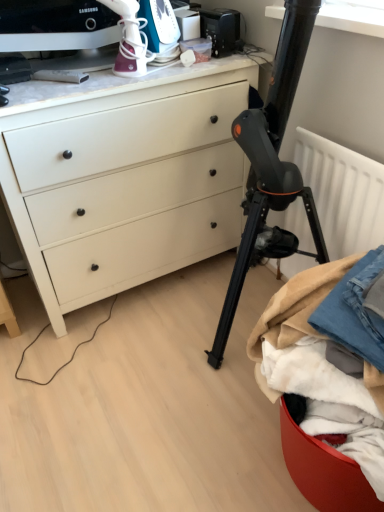
The height and width of the screenshot is (512, 384). What do you see at coordinates (127, 182) in the screenshot?
I see `matte white chest of drawers at upper left` at bounding box center [127, 182].

Measure the distance between point (218,36) and camera.

Point (218,36) and camera are 1.60 meters apart.

Find the location of a particular element. Image resolution: width=384 pixels, height=512 pixels. matte white chest of drawers at upper left is located at coordinates (127, 182).

Does white textured radiator at right appear on the right side of white plastic iron at upper center, which is the 1th appliance from left to right?

Yes, white textured radiator at right is to the right of white plastic iron at upper center, which is the 1th appliance from left to right.

Looking at this image, considering the relative sizes of white textured radiator at right and white plastic iron at upper center, positioned as the second appliance in right-to-left order, in the image provided, is white textured radiator at right thinner than white plastic iron at upper center, positioned as the second appliance in right-to-left order,?

Indeed, white textured radiator at right has a lesser width compared to white plastic iron at upper center, positioned as the second appliance in right-to-left order.

From a real-world perspective, between white textured radiator at right and white plastic iron at upper center, positioned as the second appliance in right-to-left order, who is vertically higher?

From a 3D spatial view, white plastic iron at upper center, positioned as the second appliance in right-to-left order, is above.

From a real-world perspective, is white textured radiator at right positioned above or below matte white chest of drawers at upper left?

In terms of real-world spatial position, white textured radiator at right is below matte white chest of drawers at upper left.

Find the location of a particular element. This screenshot has height=512, width=384. the chest of drawers that is in front of the white textured radiator at right is located at coordinates (127, 182).

Considering the relative positions of white textured radiator at right and matte white chest of drawers at upper left in the image provided, is white textured radiator at right to the right of matte white chest of drawers at upper left from the viewer's perspective?

Correct, you'll find white textured radiator at right to the right of matte white chest of drawers at upper left.

From the picture: Looking at their sizes, would you say white textured radiator at right is wider or thinner than matte white chest of drawers at upper left?

Considering their sizes, white textured radiator at right looks slimmer than matte white chest of drawers at upper left.

Where is `radiator lying on the right of black plastic toaster at upper center, which ranks as the 2th appliance in left-to-right order`? The height and width of the screenshot is (512, 384). radiator lying on the right of black plastic toaster at upper center, which ranks as the 2th appliance in left-to-right order is located at coordinates (343, 193).

Is black plastic toaster at upper center, which ranks as the 2th appliance in left-to-right order, turned away from white textured radiator at right?

No.

Considering the sizes of objects black plastic toaster at upper center, which ranks as the 2th appliance in left-to-right order, and white textured radiator at right in the image provided, who is thinner, black plastic toaster at upper center, which ranks as the 2th appliance in left-to-right order, or white textured radiator at right?

white textured radiator at right.

Is black plastic toaster at upper center, which ranks as the 2th appliance in left-to-right order, next to white textured radiator at right and touching it?

No, black plastic toaster at upper center, which ranks as the 2th appliance in left-to-right order, is not beside white textured radiator at right.

Based on the photo, which of these two, matte white chest of drawers at upper left or white plastic iron at upper center, which is the 1th appliance from left to right, is smaller?

With smaller size is white plastic iron at upper center, which is the 1th appliance from left to right.

How many degrees apart are the facing directions of matte white chest of drawers at upper left and white plastic iron at upper center, positioned as the second appliance in right-to-left order?

The angle between the facing direction of matte white chest of drawers at upper left and the facing direction of white plastic iron at upper center, positioned as the second appliance in right-to-left order, is 21.2 degrees.

Which is more to the left, matte white chest of drawers at upper left or white plastic iron at upper center, which is the 1th appliance from left to right?

matte white chest of drawers at upper left is more to the left.

Locate an element on the screen. the 1st appliance behind the matte white chest of drawers at upper left is located at coordinates (161, 29).

Between black plastic toaster at upper center, the first appliance in the right-to-left sequence, and denim fabric at lower right, acting as the first clothing starting from the right, which one appears on the left side from the viewer's perspective?

Positioned to the left is black plastic toaster at upper center, the first appliance in the right-to-left sequence.

Based on the photo, is black plastic toaster at upper center, the first appliance in the right-to-left sequence, aimed at denim fabric at lower right, acting as the first clothing starting from the right?

No, black plastic toaster at upper center, the first appliance in the right-to-left sequence, is not turned towards denim fabric at lower right, acting as the first clothing starting from the right.

Starting from the denim fabric at lower right, acting as the first clothing starting from the right, which appliance is the 2nd one behind? Please provide its 2D coordinates.

[(221, 30)]

What's the angular difference between black plastic toaster at upper center, which ranks as the 2th appliance in left-to-right order, and denim fabric at lower right, acting as the first clothing starting from the right,'s facing directions?

black plastic toaster at upper center, which ranks as the 2th appliance in left-to-right order, and denim fabric at lower right, acting as the first clothing starting from the right, are facing 110 degrees away from each other.

At what (x,y) coordinates should I click in order to perform the action: click on the 1st appliance above the denim fabric at lower right, arranged as the 2th clothing when viewed from the left (from the image's perspective). Please return your answer as a coordinate pair (x, y). Looking at the image, I should click on (161, 29).

Is point (169, 37) in front of point (370, 255)?

No, (169, 37) is behind (370, 255).

Is white plastic iron at upper center, positioned as the second appliance in right-to-left order, taller or shorter than denim fabric at lower right, arranged as the 2th clothing when viewed from the left?

In the image, white plastic iron at upper center, positioned as the second appliance in right-to-left order, appears to be taller than denim fabric at lower right, arranged as the 2th clothing when viewed from the left.

Could denim fabric at lower right, arranged as the 2th clothing when viewed from the left, be considered to be inside white plastic iron at upper center, positioned as the second appliance in right-to-left order?

No, denim fabric at lower right, arranged as the 2th clothing when viewed from the left, is not inside white plastic iron at upper center, positioned as the second appliance in right-to-left order.

Considering the positions of point (301, 321) and point (96, 91), is point (301, 321) closer or farther from the camera than point (96, 91)?

Clearly, point (301, 321) is closer to the camera than point (96, 91).

Would you say matte white chest of drawers at upper left is part of denim fabric at lower right, placed as the 2th clothing when sorted from right to left,'s contents?

No, matte white chest of drawers at upper left is not surrounded by denim fabric at lower right, placed as the 2th clothing when sorted from right to left.

Is denim fabric at lower right, placed as the 2th clothing when sorted from right to left, smaller than matte white chest of drawers at upper left?

Yes.

From the image's perspective, does denim fabric at lower right, placed as the 2th clothing when sorted from right to left, appear lower than matte white chest of drawers at upper left?

Yes.

Where is `radiator in front of the white plastic iron at upper center, positioned as the second appliance in right-to-left order`? radiator in front of the white plastic iron at upper center, positioned as the second appliance in right-to-left order is located at coordinates (343, 193).

Find the location of a particular element. The width and height of the screenshot is (384, 512). radiator beneath the matte white chest of drawers at upper left (from a real-world perspective) is located at coordinates (343, 193).

From the image, which object appears to be farther from white plastic iron at upper center, positioned as the second appliance in right-to-left order, white textured radiator at right or denim fabric at lower right, placed as the 2th clothing when sorted from right to left?

denim fabric at lower right, placed as the 2th clothing when sorted from right to left, is positioned further to the anchor white plastic iron at upper center, positioned as the second appliance in right-to-left order.

Consider the image. From the image, which object appears to be nearer to white textured radiator at right, denim fabric at lower right, placed as the 2th clothing when sorted from right to left, or denim fabric at lower right, acting as the first clothing starting from the right?

denim fabric at lower right, acting as the first clothing starting from the right, is closer to white textured radiator at right.

When comparing their distances from black plastic toaster at upper center, the first appliance in the right-to-left sequence, does matte white chest of drawers at upper left or white textured radiator at right seem closer?

matte white chest of drawers at upper left is positioned closer to the anchor black plastic toaster at upper center, the first appliance in the right-to-left sequence.

From the image, which object appears to be nearer to white plastic iron at upper center, which is the 1th appliance from left to right, white textured radiator at right or matte white chest of drawers at upper left?

matte white chest of drawers at upper left.

Considering their positions, is white plastic iron at upper center, which is the 1th appliance from left to right, positioned further to white textured radiator at right than denim fabric at lower right, placed as the 2th clothing when sorted from right to left?

white plastic iron at upper center, which is the 1th appliance from left to right.

When comparing their distances from denim fabric at lower right, arranged as the 2th clothing when viewed from the left, does black plastic toaster at upper center, the first appliance in the right-to-left sequence, or white plastic iron at upper center, which is the 1th appliance from left to right, seem closer?

white plastic iron at upper center, which is the 1th appliance from left to right, is closer to denim fabric at lower right, arranged as the 2th clothing when viewed from the left.

Based on their spatial positions, is white plastic iron at upper center, positioned as the second appliance in right-to-left order, or white textured radiator at right further from denim fabric at lower right, acting as the 1th clothing starting from the left?

white plastic iron at upper center, positioned as the second appliance in right-to-left order, is positioned further to the anchor denim fabric at lower right, acting as the 1th clothing starting from the left.

Looking at this image, considering their positions, is denim fabric at lower right, placed as the 2th clothing when sorted from right to left, positioned further to white plastic iron at upper center, positioned as the second appliance in right-to-left order, than black plastic toaster at upper center, the first appliance in the right-to-left sequence?

denim fabric at lower right, placed as the 2th clothing when sorted from right to left, is positioned further to the anchor white plastic iron at upper center, positioned as the second appliance in right-to-left order.

What are the coordinates of `radiator between black plastic toaster at upper center, the first appliance in the right-to-left sequence, and denim fabric at lower right, placed as the 2th clothing when sorted from right to left, in the vertical direction` in the screenshot? It's located at pyautogui.click(x=343, y=193).

Find the location of a particular element. Image resolution: width=384 pixels, height=512 pixels. radiator that lies between black plastic toaster at upper center, the first appliance in the right-to-left sequence, and denim fabric at lower right, arranged as the 2th clothing when viewed from the left, from top to bottom is located at coordinates (343, 193).

Identify the location of the chest of drawers that lies between black plastic toaster at upper center, which ranks as the 2th appliance in left-to-right order, and denim fabric at lower right, placed as the 2th clothing when sorted from right to left, from top to bottom. (127, 182).

Find the location of a particular element. radiator between white plastic iron at upper center, positioned as the second appliance in right-to-left order, and denim fabric at lower right, acting as the first clothing starting from the right, in the up-down direction is located at coordinates (343, 193).